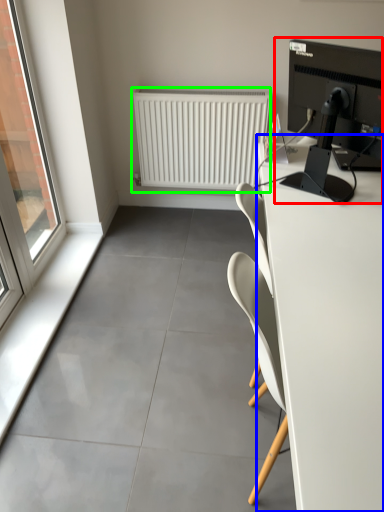
Question: Based on their relative distances, which object is nearer to desktop computer (highlighted by a red box)? Choose from desk (highlighted by a blue box) and radiator (highlighted by a green box).

Choices:
 (A) desk
 (B) radiator

Answer: (A)